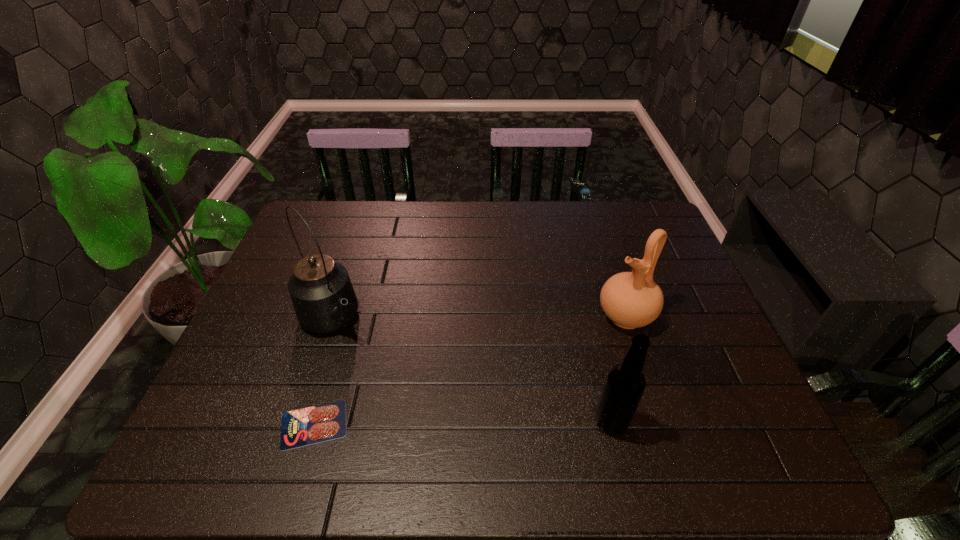
Locate an element on the screen. The width and height of the screenshot is (960, 540). blank area in the image that satisfies the following two spatial constraints: 1. on the back side of the salami; 2. on the right side of the beer bottle is located at coordinates (315, 422).

Image resolution: width=960 pixels, height=540 pixels. In order to click on free space that satisfies the following two spatial constraints: 1. on the back side of the shortest object; 2. on the left side of the beer bottle in this screenshot , I will do tap(315, 422).